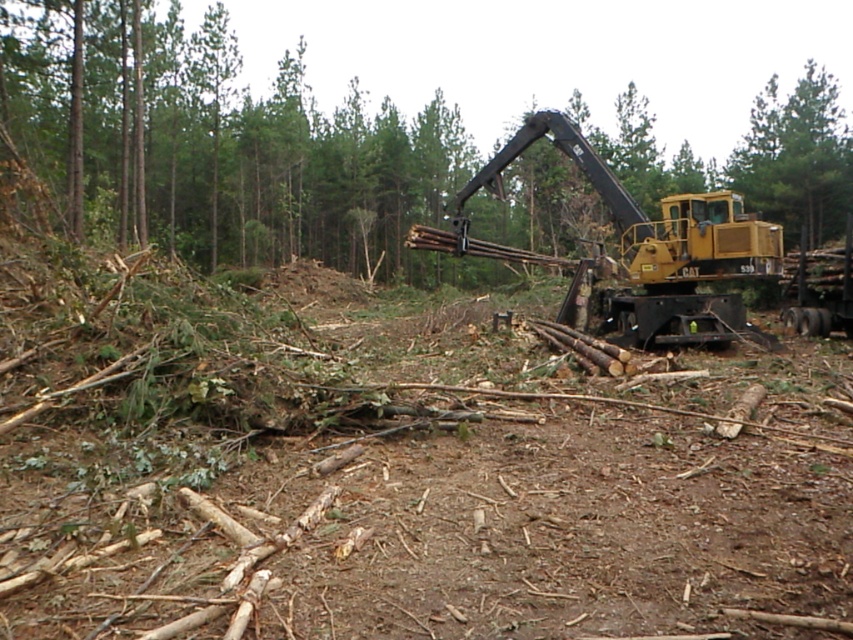
Based on the scene description, which tree has a rougher texture in its bark when comparing the green leafy tree at center and the green rough bark tree at upper right?

The green rough bark tree at upper right has a rougher texture in its bark compared to the green leafy tree at center.

You are a forester planning to move the yellow metallic excavator at right closer to the green rough bark tree at upper right. Considering their sizes, will the excavator fit through a gap that is exactly the width of the tree?

The yellow metallic excavator at right is narrower than the green rough bark tree at upper right. Since the gap is exactly the width of the tree, the excavator can fit through the gap as it is narrower than the required space.

You are a forester trying to reach the yellow metallic excavator at right to operate it. There is a green leafy tree at center blocking your path. Can you walk around the tree to reach the excavator?

The yellow metallic excavator at right is behind the green leafy tree at center, so you can walk around the tree to reach the excavator.